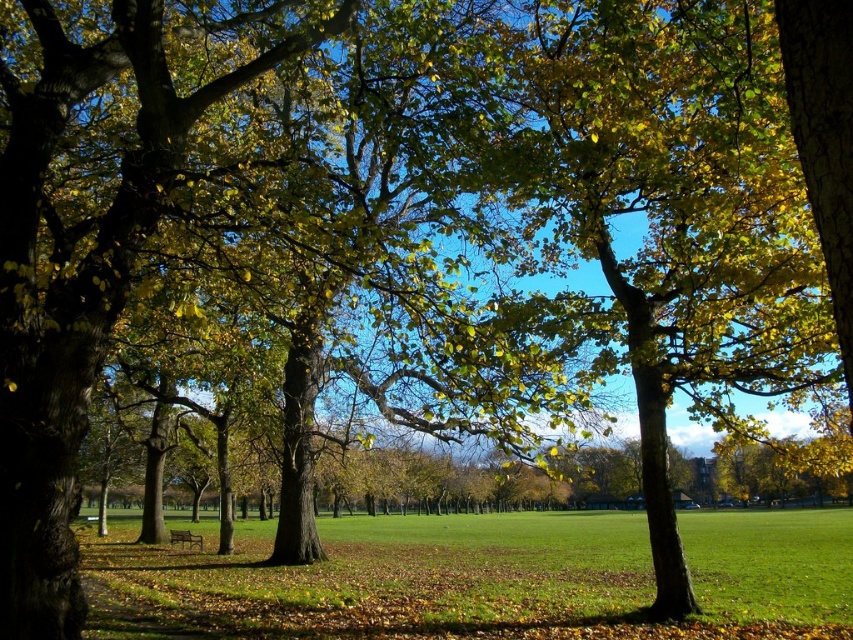
Question: Which point is closer to the camera?

Choices:
 (A) wooden bench at center
 (B) green grassy field at center

Answer: (B)

Question: Does green grassy field at center appear on the right side of wooden bench at center?

Choices:
 (A) yes
 (B) no

Answer: (A)

Question: Is green grassy field at center positioned behind wooden bench at center?

Choices:
 (A) yes
 (B) no

Answer: (B)

Question: In this image, where is green grassy field at center located relative to wooden bench at center?

Choices:
 (A) below
 (B) above

Answer: (A)